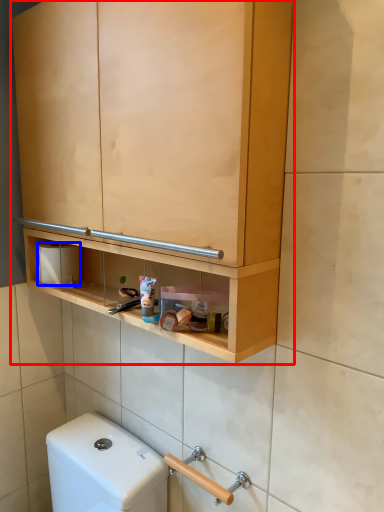
Question: Which object is closer to the camera taking this photo, cabinetry (highlighted by a red box) or toilet paper (highlighted by a blue box)?

Choices:
 (A) cabinetry
 (B) toilet paper

Answer: (A)